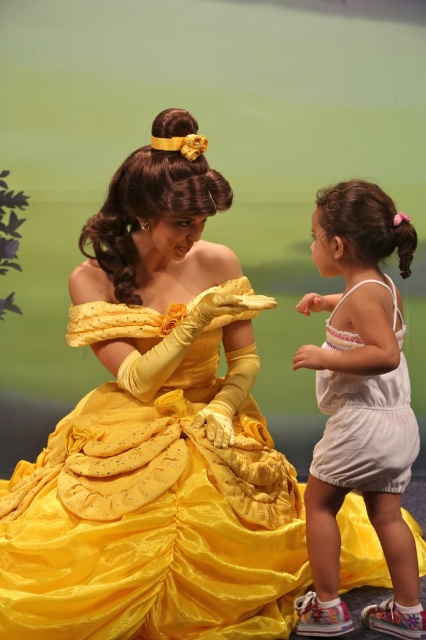
Question: Does matte yellow dress at center have a larger size compared to white cotton romper at lower right?

Choices:
 (A) yes
 (B) no

Answer: (A)

Question: Which object is positioned farthest from the matte yellow dress at center?

Choices:
 (A) white cotton romper at lower right
 (B) white cotton romper at right

Answer: (A)

Question: Is matte yellow dress at center above white cotton romper at lower right?

Choices:
 (A) no
 (B) yes

Answer: (B)

Question: Which object appears closest to the camera in this image?

Choices:
 (A) matte yellow dress at center
 (B) white cotton romper at right

Answer: (A)

Question: From the image, what is the correct spatial relationship of matte yellow dress at center in relation to white cotton romper at right?

Choices:
 (A) above
 (B) below

Answer: (A)

Question: Which of the following is the closest to the observer?

Choices:
 (A) white cotton romper at lower right
 (B) white cotton romper at right
 (C) matte yellow dress at center

Answer: (C)